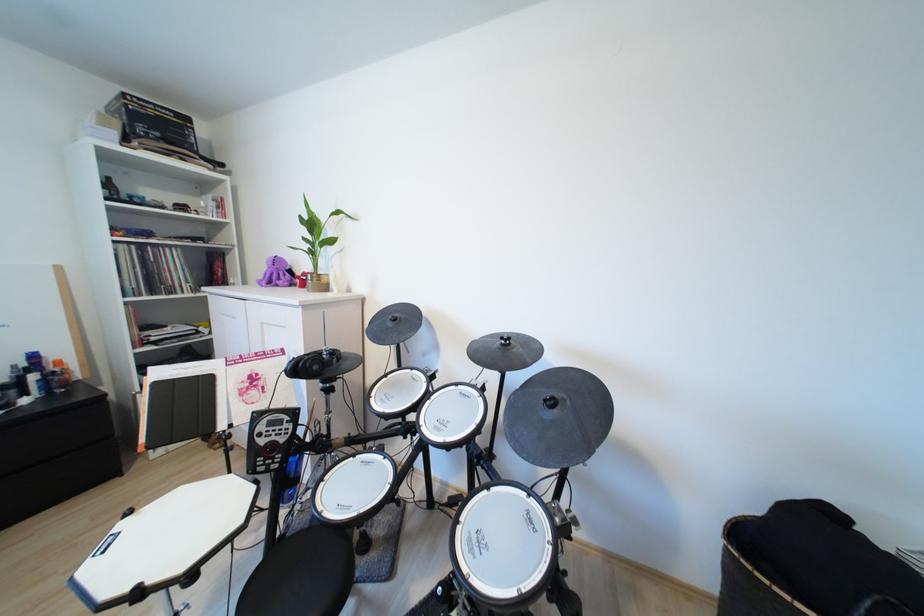
This screenshot has width=924, height=616. What do you see at coordinates (301, 575) in the screenshot?
I see `the chair sitting surface` at bounding box center [301, 575].